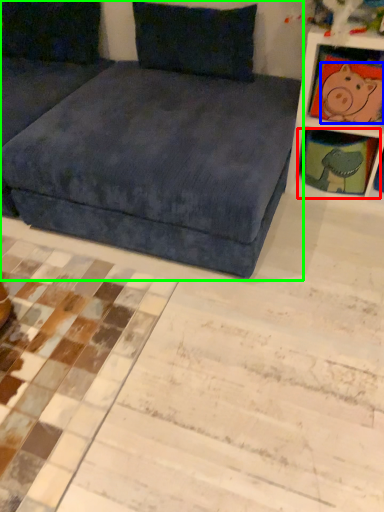
Question: Which is nearer to the shelf (highlighted by a red box)? animal (highlighted by a blue box) or studio couch (highlighted by a green box).

Choices:
 (A) animal
 (B) studio couch

Answer: (A)